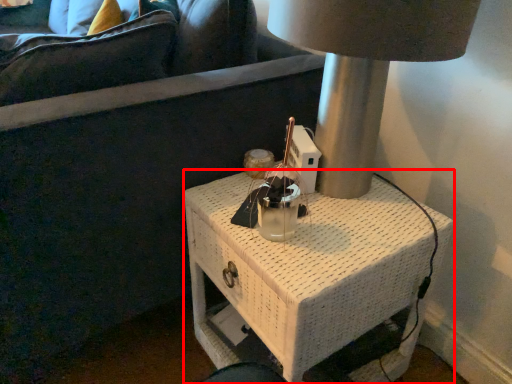
Question: From the image's perspective, where is nightstand (annotated by the red box) located relative to lamp?

Choices:
 (A) above
 (B) below

Answer: (B)